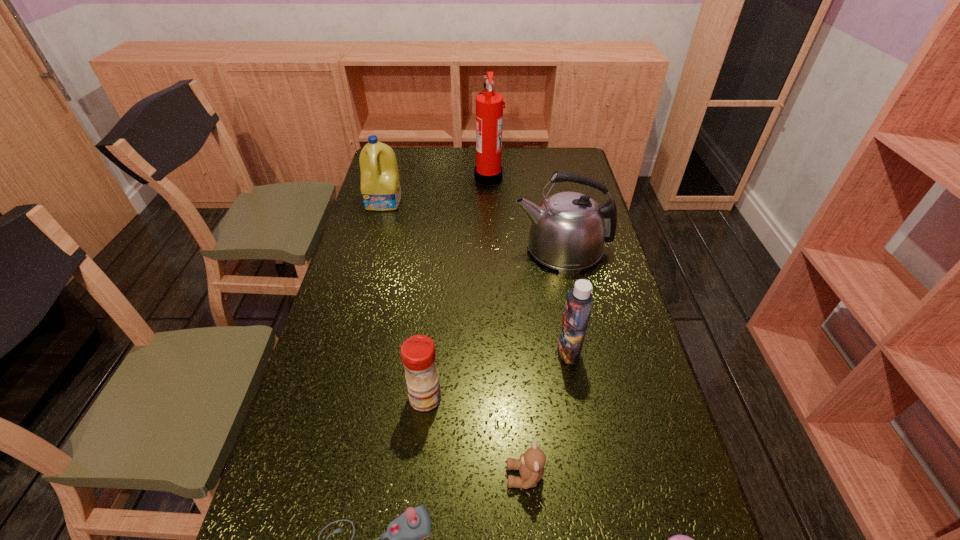
In order to click on unoccupied area between the sixth nearest object and the shampoo in this screenshot , I will do `click(565, 300)`.

I want to click on vacant space that's between the detergent and the fifth farthest object, so click(x=405, y=300).

This screenshot has width=960, height=540. I want to click on vacant space that is in between the teddy bear and the shampoo, so click(547, 414).

At what (x,y) coordinates should I click in order to perform the action: click on empty location between the detergent and the third farthest object. Please return your answer as a coordinate pair (x, y). This screenshot has width=960, height=540. Looking at the image, I should click on (473, 225).

Find the location of a particular element. The width and height of the screenshot is (960, 540). object identified as the third closest to the fourth farthest object is located at coordinates (418, 355).

Image resolution: width=960 pixels, height=540 pixels. Identify the location of object that is the second closest one to the fourth nearest object. pyautogui.click(x=405, y=532).

Where is `vacant space that satisfies the following two spatial constraints: 1. with the nozzle aimed from the tallest object; 2. on the label of the detergent`? vacant space that satisfies the following two spatial constraints: 1. with the nozzle aimed from the tallest object; 2. on the label of the detergent is located at coordinates (489, 201).

What are the coordinates of `vacant space that satisfies the following two spatial constraints: 1. on the label of the fifth tallest object; 2. on the left side of the detergent` in the screenshot? It's located at (331, 397).